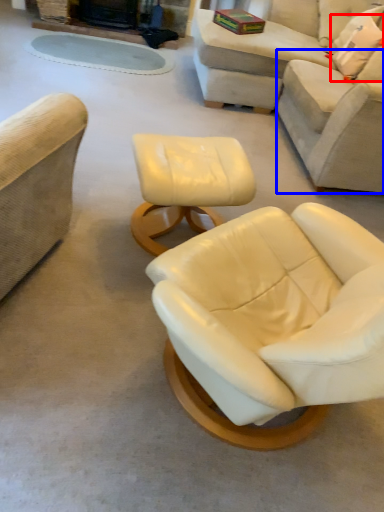
Question: Which object appears farthest to the camera in this image, pillow (highlighted by a red box) or couch (highlighted by a blue box)?

Choices:
 (A) pillow
 (B) couch

Answer: (A)